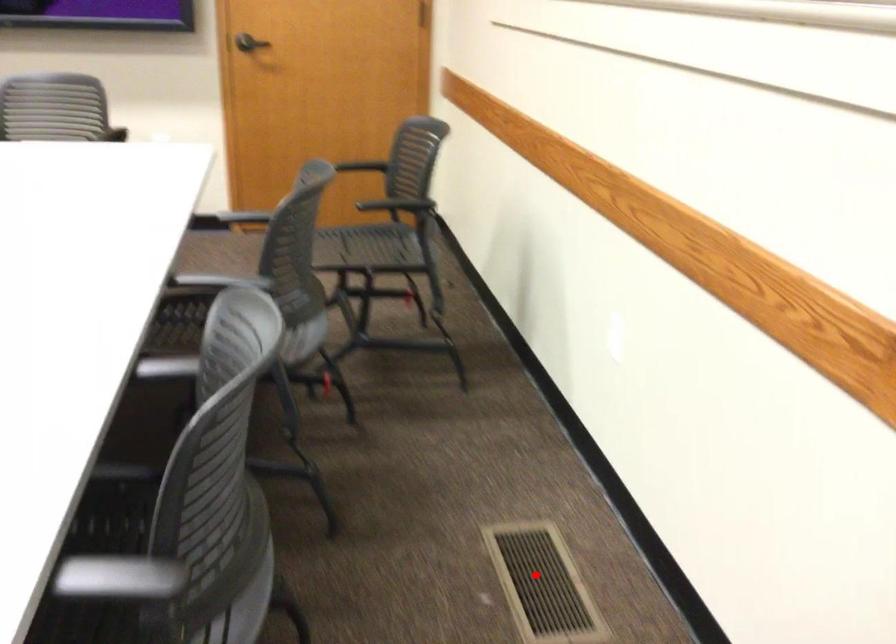
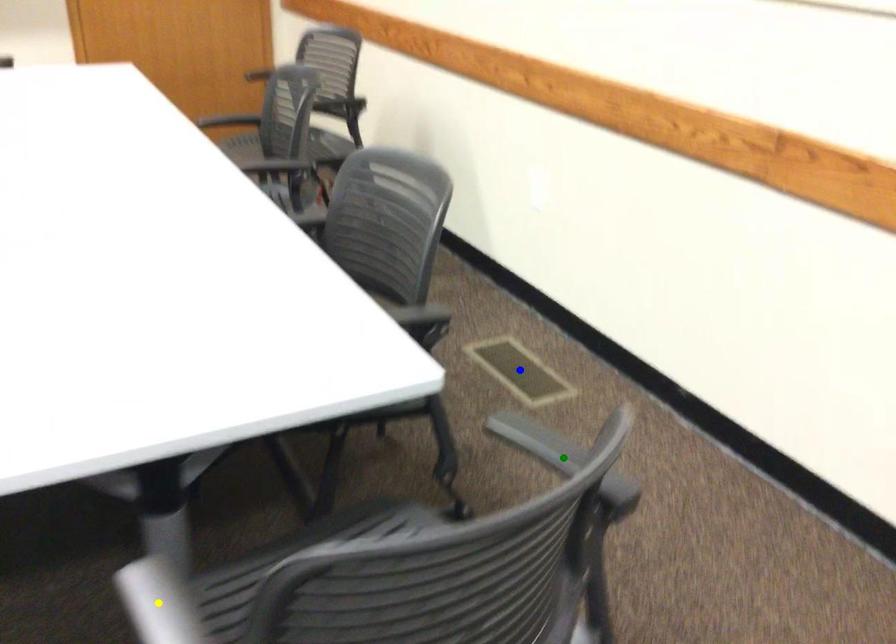
Question: I am providing you with two images of the same scene from different viewpoints. A red point is marked on the first image. You are given multiple points on the second image. Which mark in image 2 goes with the point in image 1?

Choices:
 (A) blue point
 (B) green point
 (C) yellow point

Answer: (A)